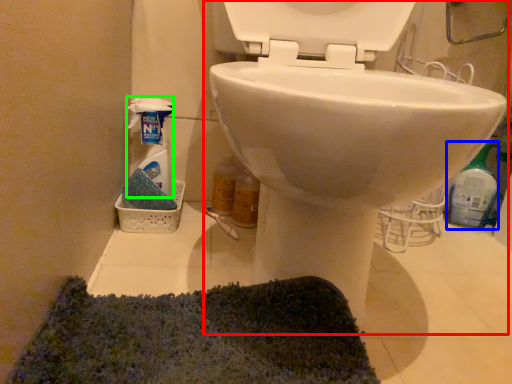
Question: Considering the real-world distances, which object is farthest from toilet (highlighted by a red box)? cleaning product (highlighted by a blue box) or cleaning product (highlighted by a green box)?

Choices:
 (A) cleaning product
 (B) cleaning product

Answer: (A)